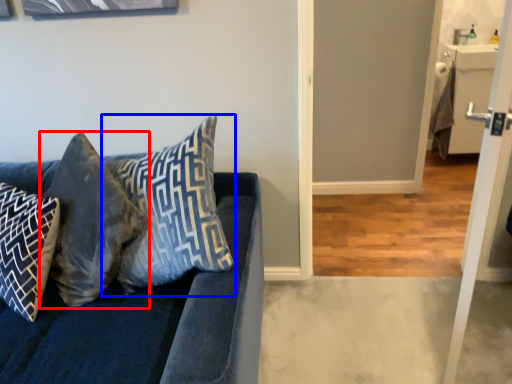
Question: Which object is closer to the camera taking this photo, pillow (highlighted by a red box) or pillow (highlighted by a blue box)?

Choices:
 (A) pillow
 (B) pillow

Answer: (B)